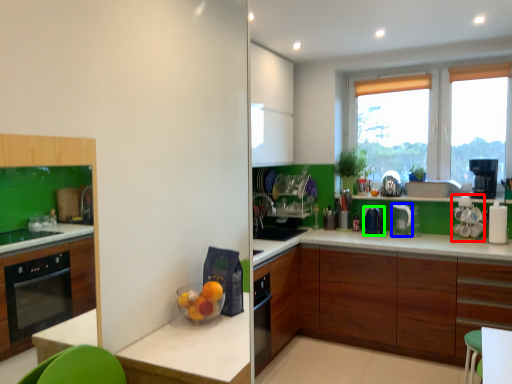
Question: Which object is positioned closest to appliance (highlighted by a red box)? Select from kitchen appliance (highlighted by a blue box) and kitchen appliance (highlighted by a green box).

Choices:
 (A) kitchen appliance
 (B) kitchen appliance

Answer: (A)